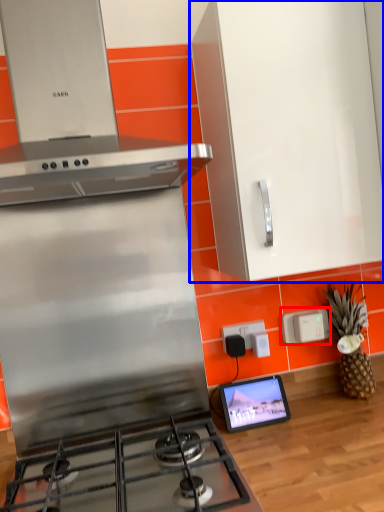
Question: Which of the following is the farthest to the observer, electric outlet (highlighted by a red box) or cabinetry (highlighted by a blue box)?

Choices:
 (A) electric outlet
 (B) cabinetry

Answer: (A)